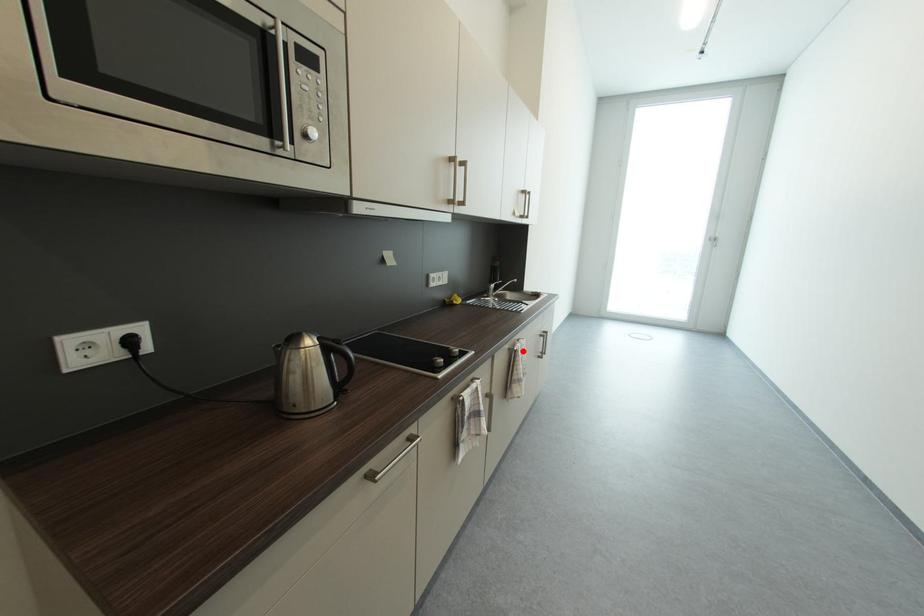
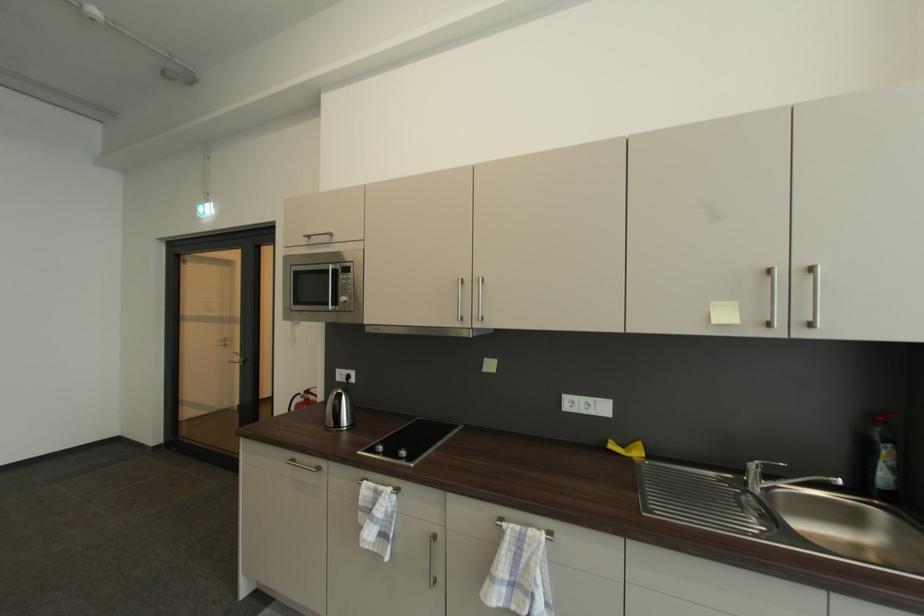
The point at the highlighted location is marked in the first image. Where is the corresponding point in the second image?

(507, 529)